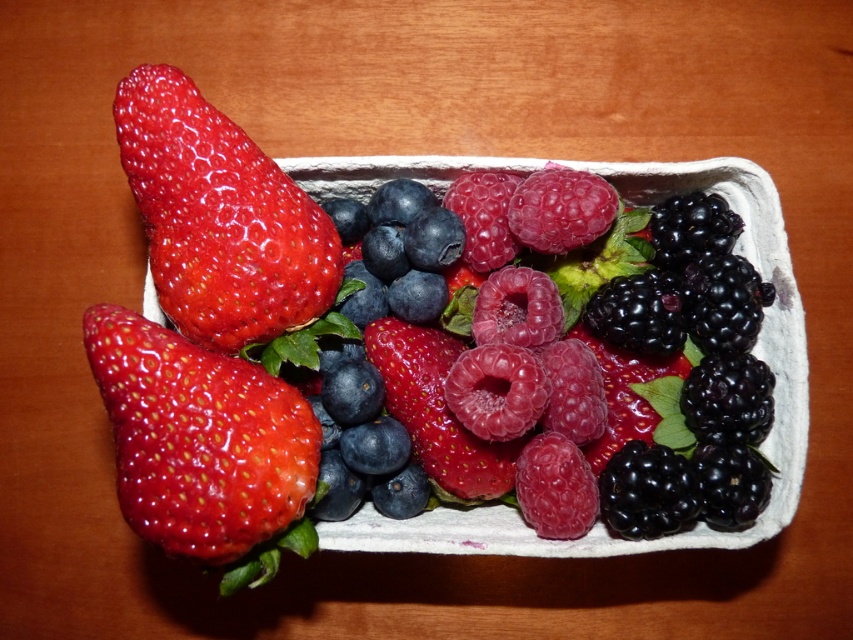
You are a chef preparing a dessert and need to choose the largest strawberry between the shiny red strawberry at lower left and the shiny red strawberry at upper left. Which one should you pick?

The shiny red strawberry at lower left is larger in size compared to the shiny red strawberry at upper left, so you should pick the shiny red strawberry at lower left.

You are arranging berries in a container and notice two strawberries, the shiny red strawberry at upper left and the glossy red strawberry at center. Which strawberry is closer to you?

The shiny red strawberry at upper left is closer because it is in front of the glossy red strawberry at center.

You are looking at the berries in the white cardboard container. There are two points marked in the image, point A at coordinates point (228, 269) and point B at coordinates point (387, 397). Which point is closer to you?

Point (228, 269) is closer to the camera than point (387, 397), so point A is closer to you.